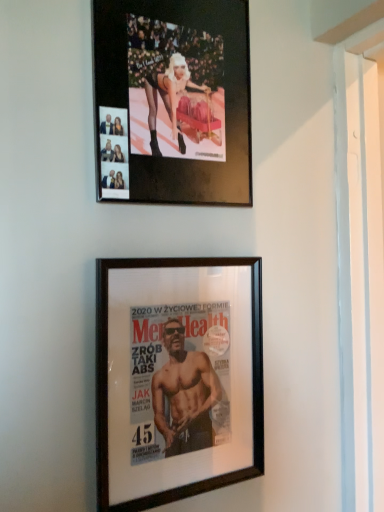
Identify the location of metallic gold photo frame at upper center, positioned as the 1th picture frame in top-to-bottom order. Image resolution: width=384 pixels, height=512 pixels. (173, 101).

What do you see at coordinates (173, 101) in the screenshot? I see `metallic gold photo frame at upper center, positioned as the 1th picture frame in top-to-bottom order` at bounding box center [173, 101].

How much space does metallic gold photo frame at upper center, acting as the 2th picture frame starting from the bottom, occupy vertically?

16.14 inches.

What is the approximate width of metallic gold photo frame at upper center, acting as the 2th picture frame starting from the bottom?

metallic gold photo frame at upper center, acting as the 2th picture frame starting from the bottom, is 1.19 inches wide.

In order to face black wood picture frame at center, the 1th picture frame ordered from the bottom, should I rotate leftwards or rightwards?

It's best to rotate left around 2.723 degrees.

The height and width of the screenshot is (512, 384). What do you see at coordinates (177, 378) in the screenshot? I see `black wood picture frame at center, the 1th picture frame ordered from the bottom` at bounding box center [177, 378].

Locate an element on the screen. This screenshot has width=384, height=512. black wood picture frame at center, the second picture frame when ordered from top to bottom is located at coordinates (177, 378).

This screenshot has width=384, height=512. I want to click on metallic gold photo frame at upper center, positioned as the 1th picture frame in top-to-bottom order, so click(x=173, y=101).

Visually, is black wood picture frame at center, the second picture frame when ordered from top to bottom, positioned to the left or to the right of metallic gold photo frame at upper center, positioned as the 1th picture frame in top-to-bottom order?

black wood picture frame at center, the second picture frame when ordered from top to bottom, is positioned on metallic gold photo frame at upper center, positioned as the 1th picture frame in top-to-bottom order,'s right side.

Which object is further away from the camera taking this photo, black wood picture frame at center, the second picture frame when ordered from top to bottom, or metallic gold photo frame at upper center, positioned as the 1th picture frame in top-to-bottom order?

metallic gold photo frame at upper center, positioned as the 1th picture frame in top-to-bottom order, is further from the camera.

Which is farther, (123,314) or (175,27)?

Positioned behind is point (175,27).

From the image's perspective, is black wood picture frame at center, the second picture frame when ordered from top to bottom, on metallic gold photo frame at upper center, acting as the 2th picture frame starting from the bottom?

No.

Consider the image. From a real-world perspective, between black wood picture frame at center, the 1th picture frame ordered from the bottom, and metallic gold photo frame at upper center, positioned as the 1th picture frame in top-to-bottom order, who is vertically higher?

From a 3D spatial view, metallic gold photo frame at upper center, positioned as the 1th picture frame in top-to-bottom order, is above.

Can you confirm if black wood picture frame at center, the second picture frame when ordered from top to bottom, is wider than metallic gold photo frame at upper center, acting as the 2th picture frame starting from the bottom?

Incorrect, the width of black wood picture frame at center, the second picture frame when ordered from top to bottom, does not surpass that of metallic gold photo frame at upper center, acting as the 2th picture frame starting from the bottom.

In the scene shown: Is black wood picture frame at center, the second picture frame when ordered from top to bottom, taller than metallic gold photo frame at upper center, acting as the 2th picture frame starting from the bottom?

Yes.

Considering the sizes of objects black wood picture frame at center, the second picture frame when ordered from top to bottom, and metallic gold photo frame at upper center, acting as the 2th picture frame starting from the bottom, in the image provided, who is bigger, black wood picture frame at center, the second picture frame when ordered from top to bottom, or metallic gold photo frame at upper center, acting as the 2th picture frame starting from the bottom,?

Bigger between the two is metallic gold photo frame at upper center, acting as the 2th picture frame starting from the bottom.

Would you say black wood picture frame at center, the second picture frame when ordered from top to bottom, is outside metallic gold photo frame at upper center, positioned as the 1th picture frame in top-to-bottom order?

Absolutely, black wood picture frame at center, the second picture frame when ordered from top to bottom, is external to metallic gold photo frame at upper center, positioned as the 1th picture frame in top-to-bottom order.

Is the surface of black wood picture frame at center, the second picture frame when ordered from top to bottom, in direct contact with metallic gold photo frame at upper center, positioned as the 1th picture frame in top-to-bottom order?

black wood picture frame at center, the second picture frame when ordered from top to bottom, is not next to metallic gold photo frame at upper center, positioned as the 1th picture frame in top-to-bottom order, and they're not touching.

Is black wood picture frame at center, the 1th picture frame ordered from the bottom, facing away from metallic gold photo frame at upper center, positioned as the 1th picture frame in top-to-bottom order?

That's not correct — black wood picture frame at center, the 1th picture frame ordered from the bottom, is not looking away from metallic gold photo frame at upper center, positioned as the 1th picture frame in top-to-bottom order.

In the scene shown: How many degrees apart are the facing directions of black wood picture frame at center, the second picture frame when ordered from top to bottom, and metallic gold photo frame at upper center, acting as the 2th picture frame starting from the bottom?

The angular difference between black wood picture frame at center, the second picture frame when ordered from top to bottom, and metallic gold photo frame at upper center, acting as the 2th picture frame starting from the bottom, is 0.00159 degrees.

At what (x,y) coordinates should I click in order to perform the action: click on picture frame that is below the metallic gold photo frame at upper center, positioned as the 1th picture frame in top-to-bottom order (from the image's perspective). Please return your answer as a coordinate pair (x, y). Image resolution: width=384 pixels, height=512 pixels. Looking at the image, I should click on (177, 378).

Is metallic gold photo frame at upper center, acting as the 2th picture frame starting from the bottom, at the left side of black wood picture frame at center, the second picture frame when ordered from top to bottom?

Correct, you'll find metallic gold photo frame at upper center, acting as the 2th picture frame starting from the bottom, to the left of black wood picture frame at center, the second picture frame when ordered from top to bottom.

Between metallic gold photo frame at upper center, positioned as the 1th picture frame in top-to-bottom order, and black wood picture frame at center, the 1th picture frame ordered from the bottom, which one is positioned in front?

black wood picture frame at center, the 1th picture frame ordered from the bottom, is closer to the camera.

Which is nearer, (226,156) or (137,483)?

Point (137,483)

From the image's perspective, is metallic gold photo frame at upper center, acting as the 2th picture frame starting from the bottom, under black wood picture frame at center, the second picture frame when ordered from top to bottom?

No, from the image's perspective, metallic gold photo frame at upper center, acting as the 2th picture frame starting from the bottom, is not beneath black wood picture frame at center, the second picture frame when ordered from top to bottom.

From a real-world perspective, which object stands above the other?

metallic gold photo frame at upper center, acting as the 2th picture frame starting from the bottom.

Which of these two, metallic gold photo frame at upper center, positioned as the 1th picture frame in top-to-bottom order, or black wood picture frame at center, the second picture frame when ordered from top to bottom, is thinner?

black wood picture frame at center, the second picture frame when ordered from top to bottom.

Between metallic gold photo frame at upper center, positioned as the 1th picture frame in top-to-bottom order, and black wood picture frame at center, the second picture frame when ordered from top to bottom, which one has less height?

With less height is metallic gold photo frame at upper center, positioned as the 1th picture frame in top-to-bottom order.

Considering the relative sizes of metallic gold photo frame at upper center, positioned as the 1th picture frame in top-to-bottom order, and black wood picture frame at center, the 1th picture frame ordered from the bottom, in the image provided, is metallic gold photo frame at upper center, positioned as the 1th picture frame in top-to-bottom order, bigger than black wood picture frame at center, the 1th picture frame ordered from the bottom,?

Indeed, metallic gold photo frame at upper center, positioned as the 1th picture frame in top-to-bottom order, has a larger size compared to black wood picture frame at center, the 1th picture frame ordered from the bottom.

Is metallic gold photo frame at upper center, acting as the 2th picture frame starting from the bottom, not within black wood picture frame at center, the 1th picture frame ordered from the bottom?

Yes, metallic gold photo frame at upper center, acting as the 2th picture frame starting from the bottom, is not within black wood picture frame at center, the 1th picture frame ordered from the bottom.

Is there a large distance between metallic gold photo frame at upper center, acting as the 2th picture frame starting from the bottom, and black wood picture frame at center, the 1th picture frame ordered from the bottom?

They are positioned close to each other.

Is metallic gold photo frame at upper center, acting as the 2th picture frame starting from the bottom, positioned with its back to black wood picture frame at center, the second picture frame when ordered from top to bottom?

No, metallic gold photo frame at upper center, acting as the 2th picture frame starting from the bottom, is not facing away from black wood picture frame at center, the second picture frame when ordered from top to bottom.

How different are the orientations of metallic gold photo frame at upper center, positioned as the 1th picture frame in top-to-bottom order, and black wood picture frame at center, the second picture frame when ordered from top to bottom, in degrees?

There is a 0.00159-degree angle between the facing directions of metallic gold photo frame at upper center, positioned as the 1th picture frame in top-to-bottom order, and black wood picture frame at center, the second picture frame when ordered from top to bottom.

How far apart are metallic gold photo frame at upper center, acting as the 2th picture frame starting from the bottom, and black wood picture frame at center, the second picture frame when ordered from top to bottom?

metallic gold photo frame at upper center, acting as the 2th picture frame starting from the bottom, and black wood picture frame at center, the second picture frame when ordered from top to bottom, are 11.65 inches apart.

Find the location of a particular element. The height and width of the screenshot is (512, 384). picture frame above the black wood picture frame at center, the 1th picture frame ordered from the bottom (from a real-world perspective) is located at coordinates point(173,101).

You are a GUI agent. You are given a task and a screenshot of the screen. Output one action in this format:
    pyautogui.click(x=<x>, y=<y>)
    Task: Click on the picture frame positioned vertically above the black wood picture frame at center, the 1th picture frame ordered from the bottom (from a real-world perspective)
    This screenshot has width=384, height=512.
    Given the screenshot: What is the action you would take?
    pyautogui.click(x=173, y=101)

At what (x,y) coordinates should I click in order to perform the action: click on picture frame that is in front of the metallic gold photo frame at upper center, positioned as the 1th picture frame in top-to-bottom order. Please return your answer as a coordinate pair (x, y). The height and width of the screenshot is (512, 384). Looking at the image, I should click on (177, 378).